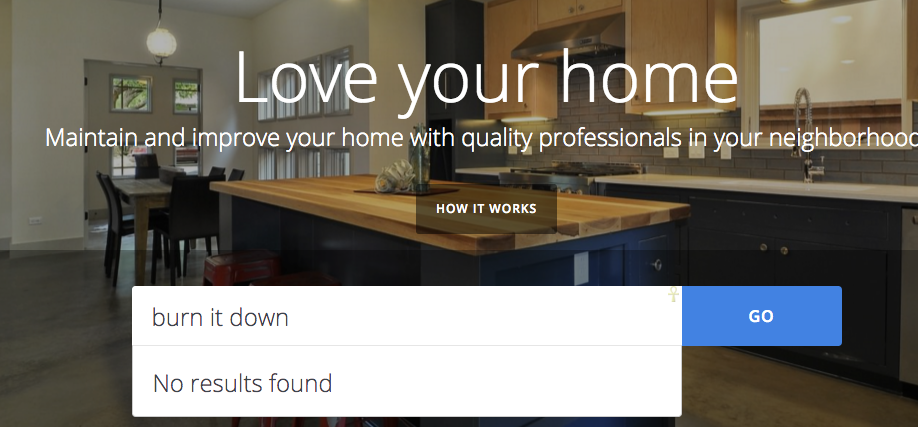
Locate an element on the screen. sink is located at coordinates (789, 187).